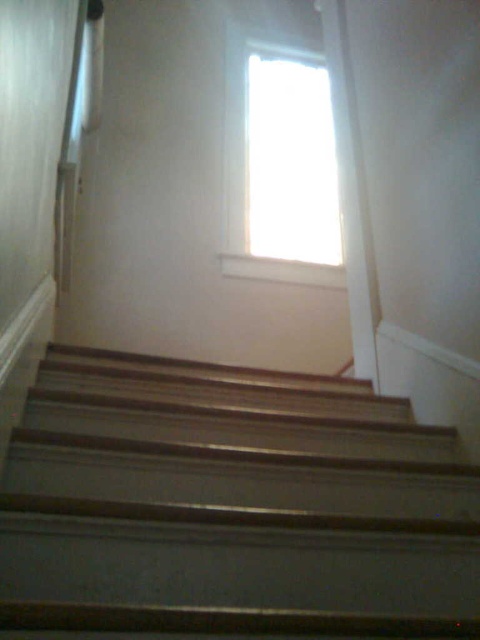
Looking at this image, is wooden stairs at center in front of transparent glass window at upper center?

Yes.

Is wooden stairs at center to the right of transparent glass window at upper center from the viewer's perspective?

Incorrect, wooden stairs at center is not on the right side of transparent glass window at upper center.

The width and height of the screenshot is (480, 640). Describe the element at coordinates (230, 508) in the screenshot. I see `wooden stairs at center` at that location.

Image resolution: width=480 pixels, height=640 pixels. Identify the location of wooden stairs at center. (230, 508).